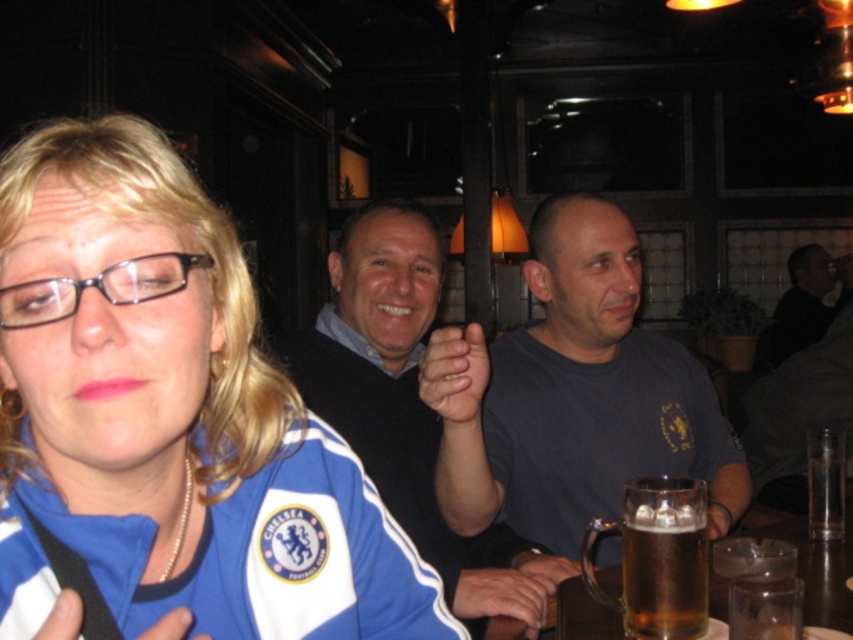
Question: Observing the image, what is the correct spatial positioning of black sweater at center in reference to translucent glass mug at lower center?

Choices:
 (A) above
 (B) below

Answer: (A)

Question: Which point is closer to the camera?

Choices:
 (A) (344, 284)
 (B) (583, 621)
 (C) (544, 362)

Answer: (B)

Question: Can you confirm if black sweater at center is positioned below translucent glass mug at lower right?

Choices:
 (A) no
 (B) yes

Answer: (A)

Question: Among these points, which one is nearest to the camera?

Choices:
 (A) (701, 570)
 (B) (590, 608)
 (C) (453, 420)

Answer: (A)

Question: Among these points, which one is nearest to the camera?

Choices:
 (A) (405, 300)
 (B) (231, 637)

Answer: (B)

Question: Does black sweater at center come behind translucent glass mug at lower right?

Choices:
 (A) yes
 (B) no

Answer: (A)